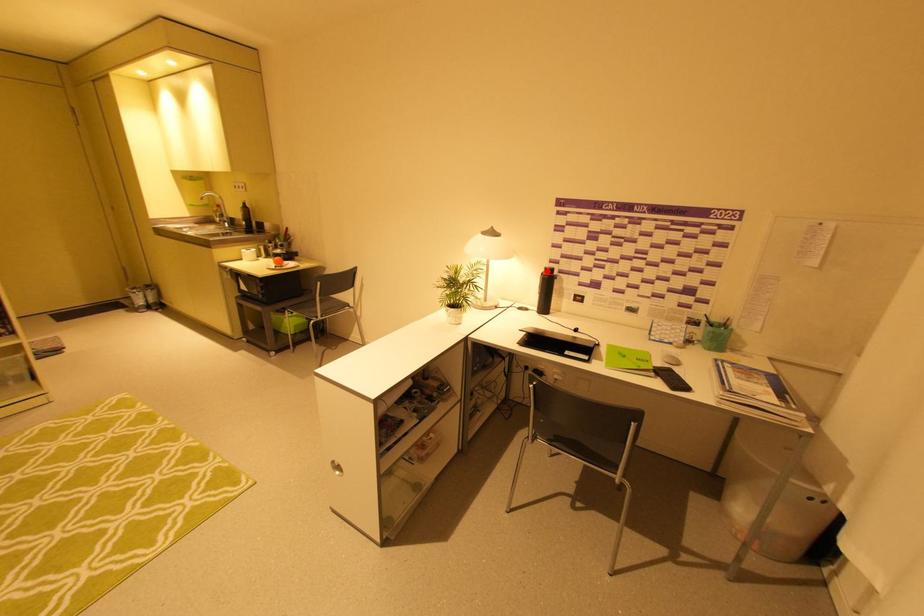
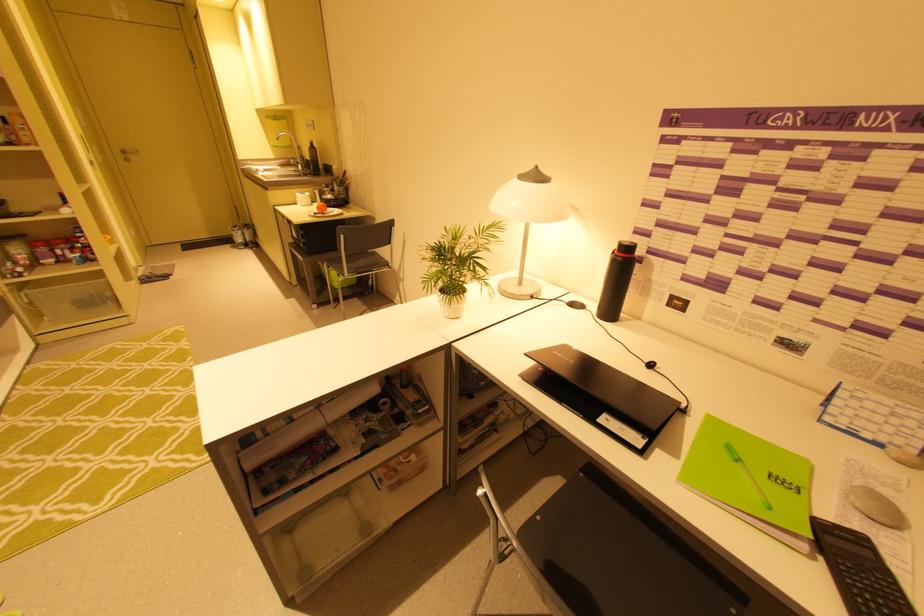
The point at the highlighted location is marked in the first image. Where is the corresponding point in the second image?

(619, 248)